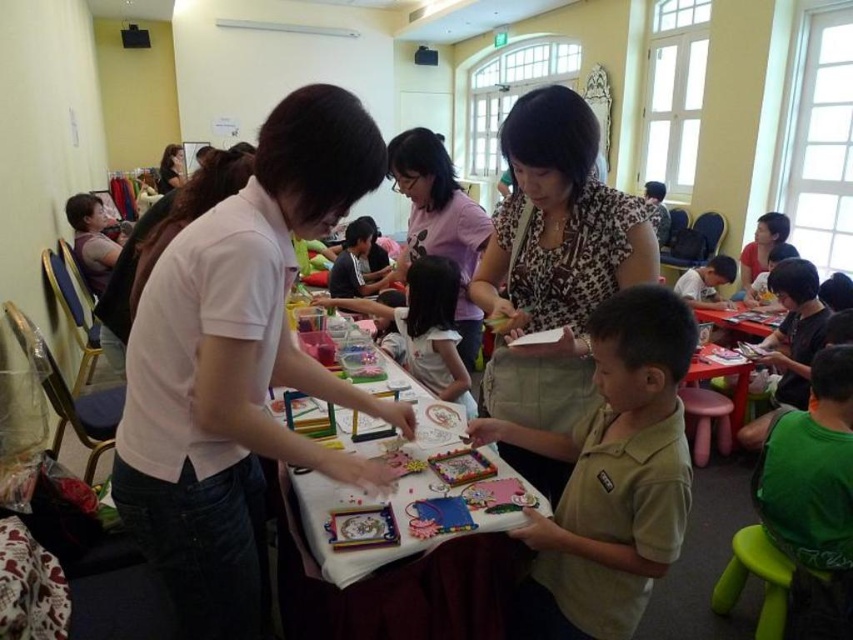
You are standing at the entrance of the room and want to locate the light brown cotton shirt at center. Based on the coordinates provided in the Objects Description, can you determine if it is positioned closer to the left or right side of the image?

The light brown cotton shirt at center is located at point 0.745 on the x and y axis, which means it is closer to the right side of the image.

Consider the image. You are standing in the classroom and want to determine which of the two points, point (352, 179) or point (660, 490), is nearer to you. Based on the scene description, which one is closer?

Point (352, 179) is closer to the viewer than point (660, 490).

You are a photographer standing behind the table in the classroom scene. You want to take a photo of the adult with the white matte shirt at center without the light brown cotton shirt at center blocking the view. Is this possible based on their positions?

The white matte shirt at center is in front of the light brown cotton shirt at center, so taking a photo from behind the table would allow the white matte shirt at center to be visible without obstruction from the light brown cotton shirt at center.